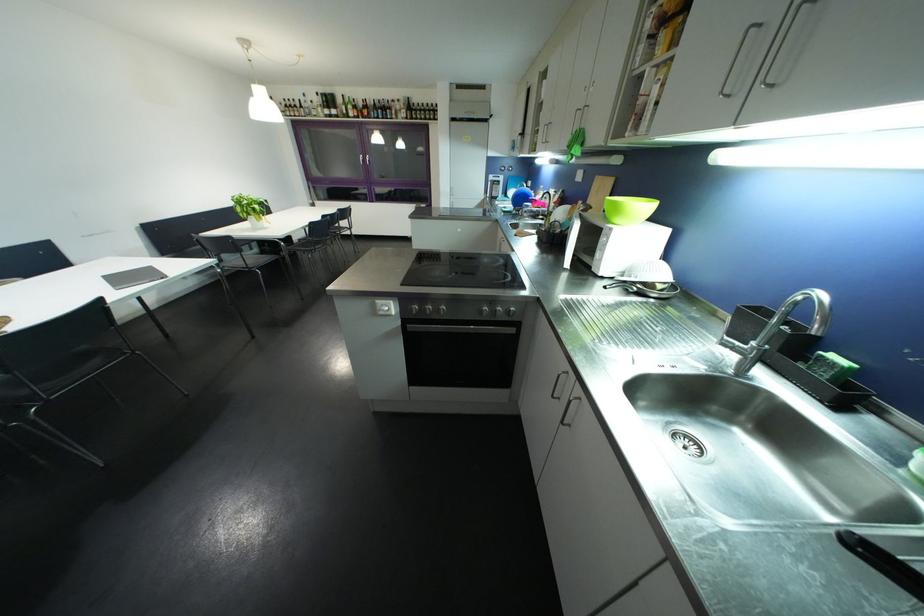
Locate an element on the screen. The width and height of the screenshot is (924, 616). faucet handle is located at coordinates (819, 310).